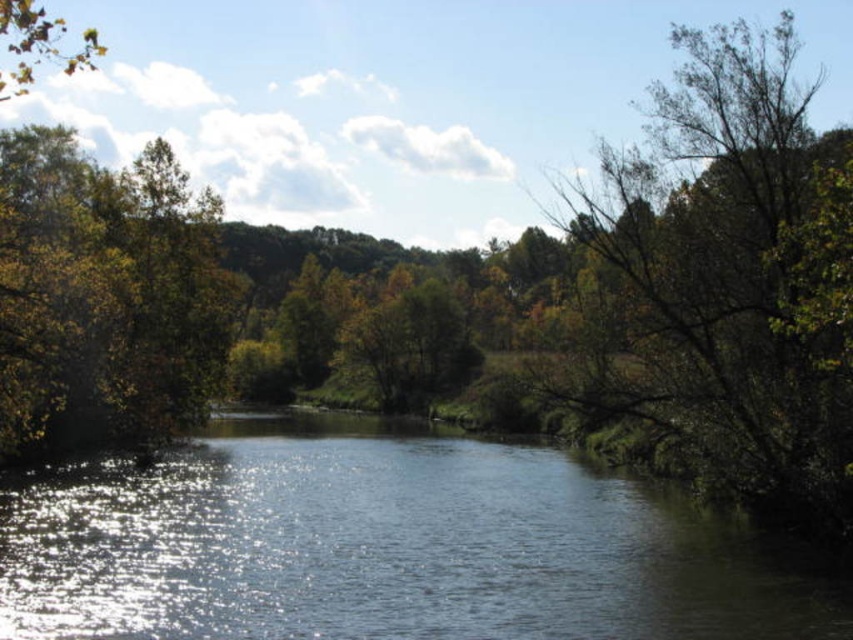
Who is taller, clear water at center or green leafy tree at right?

With more height is green leafy tree at right.

The width and height of the screenshot is (853, 640). Find the location of `clear water at center`. clear water at center is located at coordinates (389, 547).